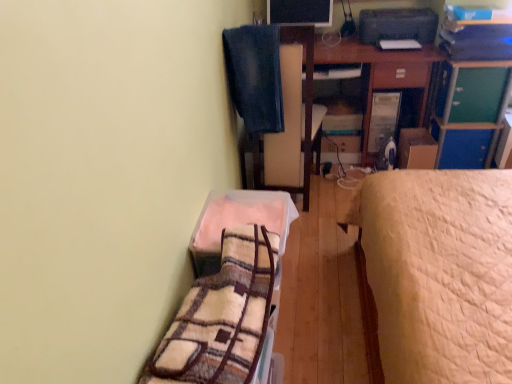
Question: Can you confirm if wooden desk at upper right is smaller than matte black monitor at upper center?

Choices:
 (A) no
 (B) yes

Answer: (A)

Question: Can you confirm if wooden desk at upper right is taller than matte black monitor at upper center?

Choices:
 (A) no
 (B) yes

Answer: (B)

Question: Considering the relative sizes of wooden desk at upper right and matte black monitor at upper center in the image provided, is wooden desk at upper right bigger than matte black monitor at upper center?

Choices:
 (A) no
 (B) yes

Answer: (B)

Question: Does wooden desk at upper right turn towards matte black monitor at upper center?

Choices:
 (A) yes
 (B) no

Answer: (B)

Question: Is wooden desk at upper right thinner than matte black monitor at upper center?

Choices:
 (A) yes
 (B) no

Answer: (B)

Question: Is green matte file cabinet at upper right in front of or behind plush beige blanket at lower center, acting as the first blanket starting from the front, in the image?

Choices:
 (A) front
 (B) behind

Answer: (B)

Question: From their relative heights in the image, would you say green matte file cabinet at upper right is taller or shorter than plush beige blanket at lower center, placed as the 2th blanket when sorted from top to bottom?

Choices:
 (A) short
 (B) tall

Answer: (B)

Question: Visually, is green matte file cabinet at upper right positioned to the left or to the right of plush beige blanket at lower center, acting as the 1th blanket starting from the bottom?

Choices:
 (A) left
 (B) right

Answer: (B)

Question: Does point (453, 62) appear closer or farther from the camera than point (217, 215)?

Choices:
 (A) closer
 (B) farther

Answer: (B)

Question: From a real-world perspective, is fuzzy fabric blanket at lower left above or below denim at upper center, placed as the first blanket when sorted from top to bottom?

Choices:
 (A) above
 (B) below

Answer: (B)

Question: Is fuzzy fabric blanket at lower left bigger or smaller than denim at upper center, placed as the first blanket when sorted from top to bottom?

Choices:
 (A) small
 (B) big

Answer: (A)

Question: Is fuzzy fabric blanket at lower left to the left or to the right of denim at upper center, the second blanket when ordered from bottom to top, in the image?

Choices:
 (A) right
 (B) left

Answer: (B)

Question: Looking at their shapes, would you say fuzzy fabric blanket at lower left is wider or thinner than denim at upper center, the second blanket when ordered from bottom to top?

Choices:
 (A) wide
 (B) thin

Answer: (B)

Question: Would you say wooden desk at upper right is to the left or to the right of matte black monitor at upper center in the picture?

Choices:
 (A) left
 (B) right

Answer: (B)

Question: Is wooden desk at upper right bigger or smaller than matte black monitor at upper center?

Choices:
 (A) small
 (B) big

Answer: (B)